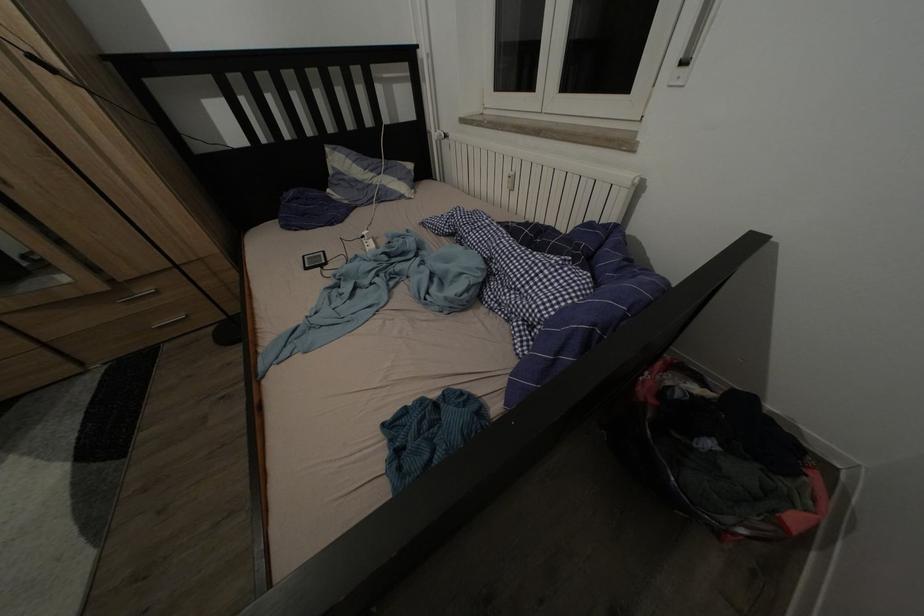
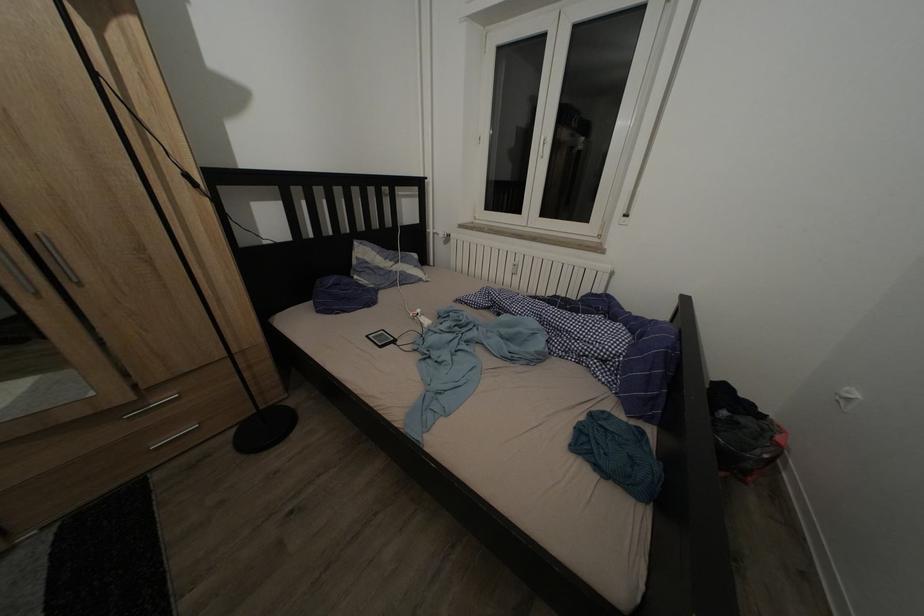
Question: The images are taken continuously from a first-person perspective. In which direction are you moving?

Choices:
 (A) Left
 (B) Right
 (C) Forward
 (D) Backward

Answer: (A)